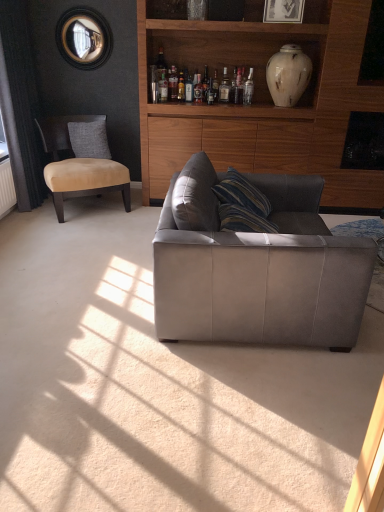
Question: From a real-world perspective, is clear glass bottle at upper center, placed as the first bottle when sorted from right to left, positioned above or below translucent glass bottle at upper center, which appears as the 2th bottle when viewed from the left?

Choices:
 (A) below
 (B) above

Answer: (A)

Question: Visually, is clear glass bottle at upper center, placed as the first bottle when sorted from right to left, positioned to the left or to the right of translucent glass bottle at upper center, which appears as the 2th bottle when viewed from the left?

Choices:
 (A) left
 (B) right

Answer: (B)

Question: Which is farther from the clear glass bottle at upper center, placed as the first bottle when sorted from right to left?

Choices:
 (A) white marble vase at upper right
 (B) translucent glass bottle at upper center, the second bottle positioned from the right
 (C) clear glass bottle at upper center, placed as the 1th bottle when sorted from left to right
 (D) translucent glass bottle at upper center, which is the third bottle from right to left
 (E) gray fabric pillow at left

Answer: (E)

Question: Considering the real-world distances, which object is closest to the suede gray couch at center?

Choices:
 (A) wooden cabinet at upper center
 (B) clear glass bottle at upper center, placed as the 1th bottle when sorted from left to right
 (C) translucent glass bottle at upper center, which appears as the 2th bottle when viewed from the left
 (D) translucent glass bottle at upper center, which is the third bottle from right to left
 (E) gray fabric pillow at left

Answer: (A)